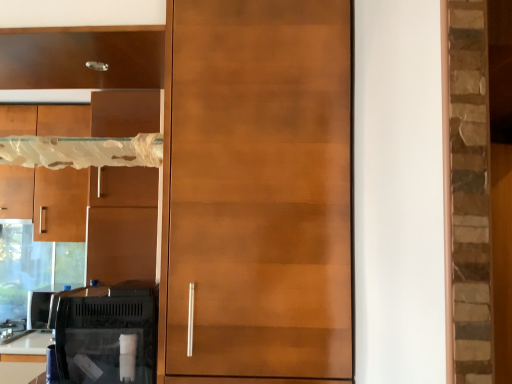
Question: From a real-world perspective, is matte brown cabinet at left, which appears as the second cabinetry when viewed from the right, located beneath glossy wood door at center?

Choices:
 (A) yes
 (B) no

Answer: (B)

Question: Is matte brown cabinet at left, which is counted as the first cabinetry, starting from the bottom, closer to the viewer compared to glossy wood door at center?

Choices:
 (A) yes
 (B) no

Answer: (B)

Question: Is glossy wood door at center at the back of matte brown cabinet at left, which is the second cabinetry from front to back?

Choices:
 (A) no
 (B) yes

Answer: (A)

Question: Is matte brown cabinet at left, which is counted as the first cabinetry, starting from the bottom, further to camera compared to glossy wood door at center?

Choices:
 (A) no
 (B) yes

Answer: (B)

Question: Is matte brown cabinet at left, which appears as the second cabinetry when viewed from the right, beside glossy wood door at center?

Choices:
 (A) yes
 (B) no

Answer: (B)

Question: Does matte brown cabinet at left, which appears as the second cabinetry when viewed from the right, have a smaller size compared to glossy wood door at center?

Choices:
 (A) yes
 (B) no

Answer: (A)

Question: Is glossy wood door at center oriented towards matte brown cabinet at left, positioned as the second cabinetry in top-to-bottom order?

Choices:
 (A) no
 (B) yes

Answer: (A)

Question: Is glossy wood door at center looking in the opposite direction of matte brown cabinet at left, positioned as the second cabinetry in top-to-bottom order?

Choices:
 (A) no
 (B) yes

Answer: (A)

Question: Is glossy wood door at center not close to matte brown cabinet at left, which appears as the second cabinetry when viewed from the right?

Choices:
 (A) no
 (B) yes

Answer: (B)

Question: From a real-world perspective, is glossy wood door at center below matte brown cabinet at left, the 1th cabinetry positioned from the back?

Choices:
 (A) yes
 (B) no

Answer: (A)

Question: From the image's perspective, is glossy wood door at center located above matte brown cabinet at left, which appears as the second cabinetry when viewed from the right?

Choices:
 (A) yes
 (B) no

Answer: (A)

Question: From the image's perspective, is glossy wood door at center below matte brown cabinet at left, positioned as the first cabinetry in left-to-right order?

Choices:
 (A) no
 (B) yes

Answer: (A)

Question: Is matte wood cabinet at upper left, the first cabinetry viewed from the top, facing away from glossy wood door at center?

Choices:
 (A) yes
 (B) no

Answer: (B)